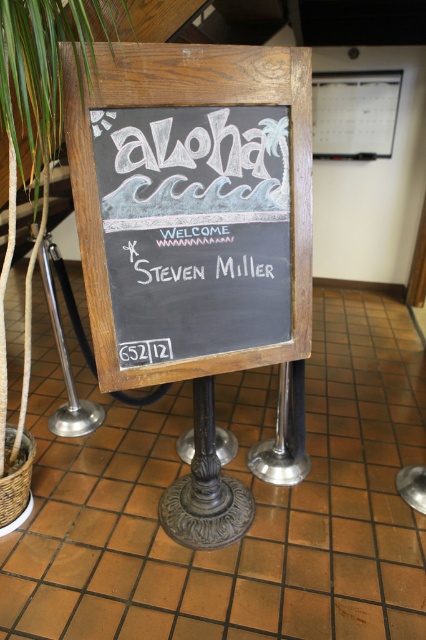
Question: Can you confirm if chalkboard at center is positioned below white chalk writing at center?

Choices:
 (A) yes
 (B) no

Answer: (B)

Question: Is green leafy plant at left bigger than white chalk writing at center?

Choices:
 (A) no
 (B) yes

Answer: (B)

Question: Which point is closer to the camera?

Choices:
 (A) white chalk writing at center
 (B) chalkboard at center
 (C) green leafy plant at left

Answer: (C)

Question: Considering the relative positions of chalkboard at center and green leafy plant at left in the image provided, where is chalkboard at center located with respect to green leafy plant at left?

Choices:
 (A) right
 (B) left

Answer: (A)

Question: Which object appears closest to the camera in this image?

Choices:
 (A) white chalk writing at center
 (B) green leafy plant at left

Answer: (B)

Question: Which object appears farthest from the camera in this image?

Choices:
 (A) chalkboard at center
 (B) green leafy plant at left

Answer: (A)